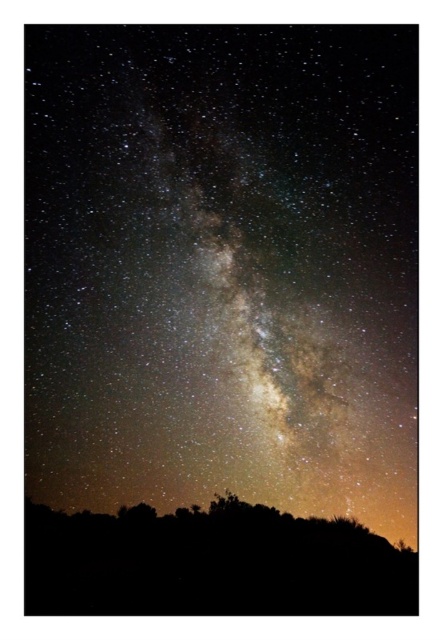
Is milky way at center positioned at the back of silhouette vegetation at lower center?

That is True.

Does milky way at center have a smaller size compared to silhouette vegetation at lower center?

Actually, milky way at center might be larger than silhouette vegetation at lower center.

Is point (381, 349) positioned in front of point (244, 515)?

No, it is behind (244, 515).

Image resolution: width=443 pixels, height=640 pixels. In order to click on milky way at center in this screenshot , I will do `click(222, 266)`.